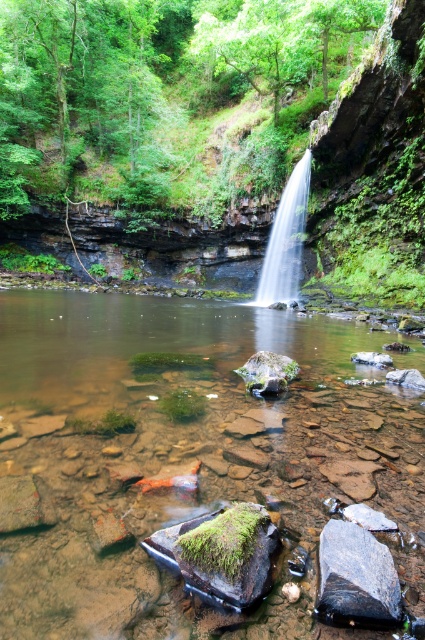
You are a hiker carrying a backpack and need to cross the water in the image. The clear stone stream at center and the clear water at center are both options. Which one is wider and safer to cross?

The clear stone stream at center is wider than the clear water at center, making it the safer option to cross.